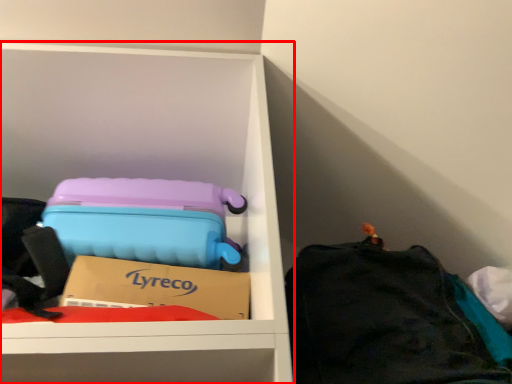
Question: Where is furniture (annotated by the red box) located in relation to luggage and bags in the image?

Choices:
 (A) left
 (B) right

Answer: (A)